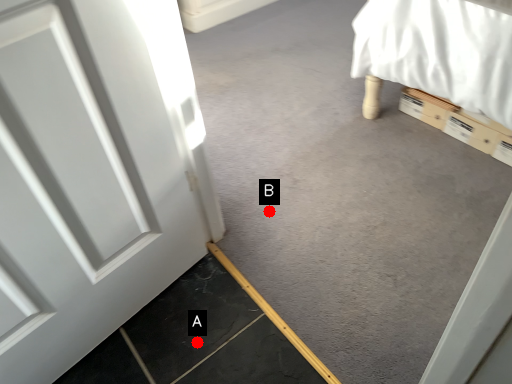
Question: Two points are circled on the image, labeled by A and B beside each circle. Which point is further to the camera?

Choices:
 (A) A is further
 (B) B is further

Answer: (B)